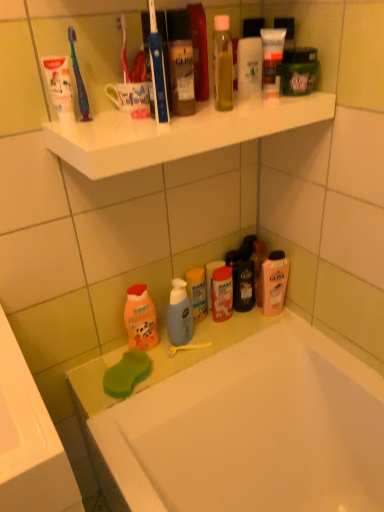
The height and width of the screenshot is (512, 384). I want to click on free space in front of matte plastic bottle at center, acting as the 3th toiletry starting from the front, so click(215, 340).